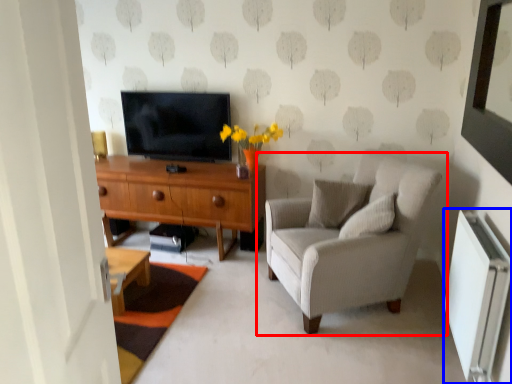
Question: Among these objects, which one is farthest to the camera, chair (highlighted by a red box) or radiator (highlighted by a blue box)?

Choices:
 (A) chair
 (B) radiator

Answer: (A)